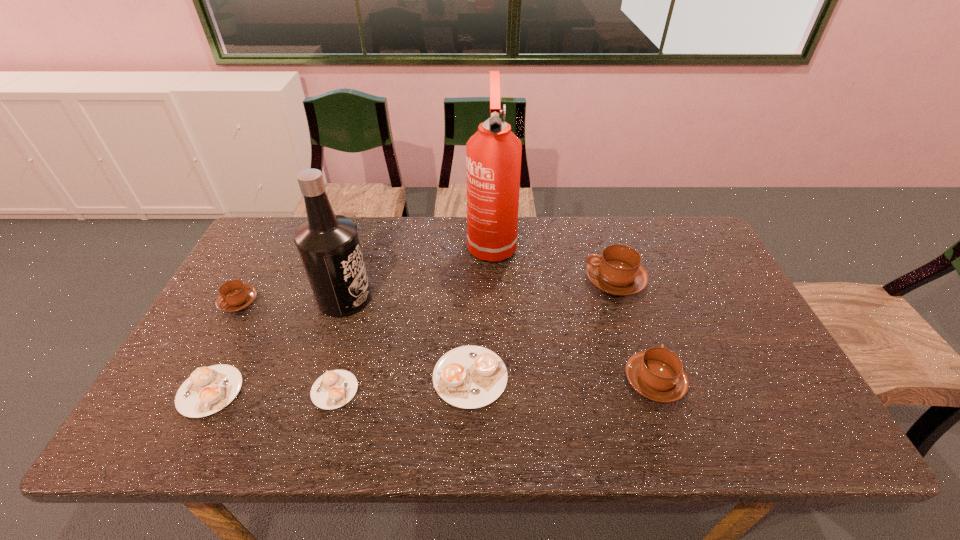
Where is `object located at the near left corner`? object located at the near left corner is located at coordinates (209, 389).

Find the location of a particular element. The width and height of the screenshot is (960, 540). vacant region at the far edge of the desktop is located at coordinates click(590, 220).

Identify the location of vacant space at the near edge of the desktop. This screenshot has width=960, height=540. (423, 429).

Locate an element on the screen. This screenshot has width=960, height=540. vacant space at the left edge of the desktop is located at coordinates (226, 319).

Find the location of `vacant space at the right edge of the desktop`. vacant space at the right edge of the desktop is located at coordinates (780, 381).

Where is `free spot between the black liquor and the second white cappuccino from left to right`? This screenshot has height=540, width=960. free spot between the black liquor and the second white cappuccino from left to right is located at coordinates point(340,344).

Where is `free space that is in between the second tallest object and the tallest object`? The height and width of the screenshot is (540, 960). free space that is in between the second tallest object and the tallest object is located at coordinates (418, 271).

The width and height of the screenshot is (960, 540). Find the location of `empty space between the black liquor and the fourth cappuccino from right to left`. empty space between the black liquor and the fourth cappuccino from right to left is located at coordinates (340, 344).

What are the coordinates of `empty space between the black liquor and the fourth cappuccino from right to left` in the screenshot? It's located at (340, 344).

Find the location of a particular element. free area in between the seventh shortest object and the shortest cappuccino is located at coordinates 340,344.